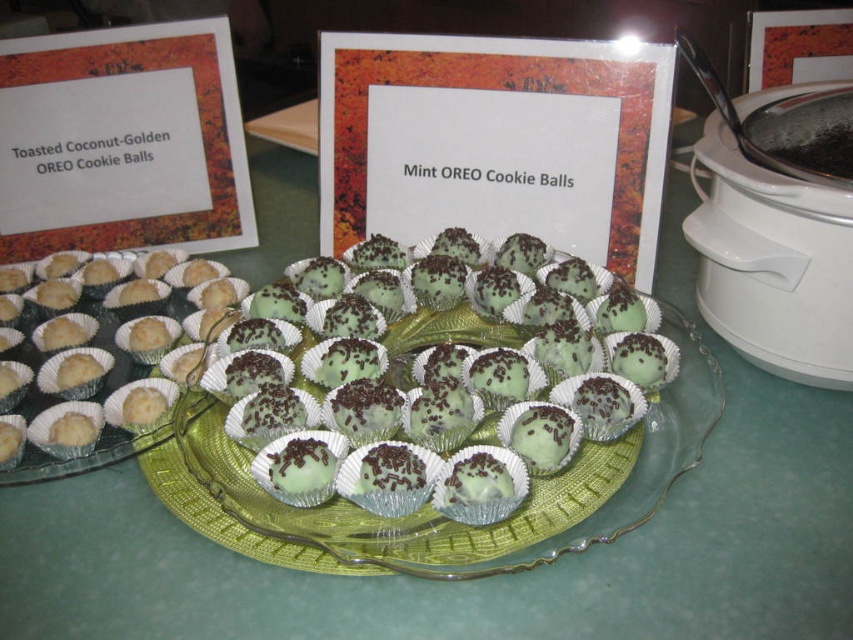
Question: Can you confirm if mint chocolate cookie balls at center is positioned to the left of white matte muffin at left?

Choices:
 (A) yes
 (B) no

Answer: (B)

Question: Which of the following is the farthest from the observer?

Choices:
 (A) white matte muffin at left
 (B) mint chocolate cookie balls at center

Answer: (A)

Question: Does mint chocolate cookie balls at center appear on the right side of white matte muffin at left?

Choices:
 (A) no
 (B) yes

Answer: (B)

Question: Is mint chocolate cookie balls at center below white matte muffin at left?

Choices:
 (A) yes
 (B) no

Answer: (A)